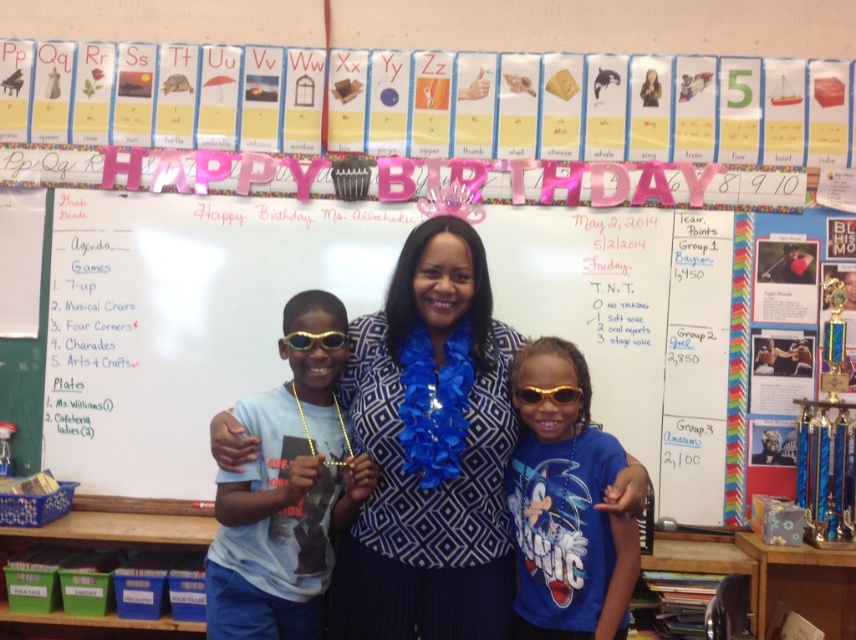
The image size is (856, 640). Describe the element at coordinates (284, 506) in the screenshot. I see `light blue t-shirt at center` at that location.

Is light blue t-shirt at center to the right of gold shiny goggles at center from the viewer's perspective?

In fact, light blue t-shirt at center is to the left of gold shiny goggles at center.

Does point (284, 595) come farther from viewer compared to point (305, 349)?

No.

Locate an element on the screen. The width and height of the screenshot is (856, 640). light blue t-shirt at center is located at coordinates (284, 506).

Between light blue t-shirt at center and gold shiny sunglasses at center, which one appears on the left side from the viewer's perspective?

Positioned to the left is light blue t-shirt at center.

Is light blue t-shirt at center bigger than gold shiny sunglasses at center?

Indeed, light blue t-shirt at center has a larger size compared to gold shiny sunglasses at center.

This screenshot has width=856, height=640. I want to click on light blue t-shirt at center, so click(284, 506).

Is blue dotted blouse at center below light blue t-shirt at center?

Incorrect, blue dotted blouse at center is not positioned below light blue t-shirt at center.

Can you confirm if blue dotted blouse at center is wider than light blue t-shirt at center?

Yes.

Image resolution: width=856 pixels, height=640 pixels. What do you see at coordinates (431, 451) in the screenshot? I see `blue dotted blouse at center` at bounding box center [431, 451].

This screenshot has height=640, width=856. What are the coordinates of `blue dotted blouse at center` in the screenshot? It's located at (431, 451).